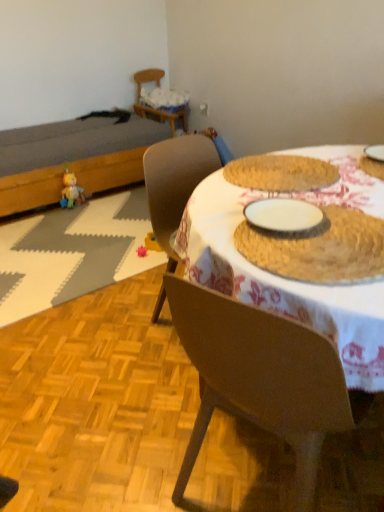
Image resolution: width=384 pixels, height=512 pixels. What are the coordinates of `free location to the left of brown matte chair at center, arranged as the 1th chair when viewed from the front` in the screenshot? It's located at (125, 440).